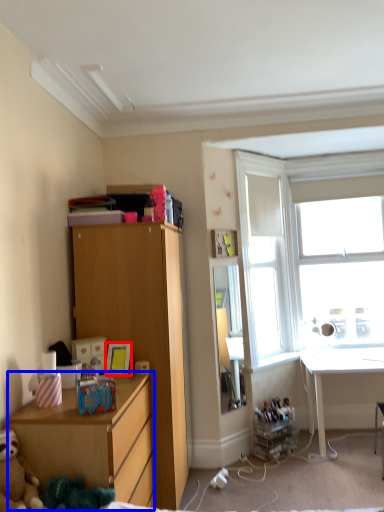
Question: Which point is further to the camera, picture frame (highlighted by a red box) or chest of drawers (highlighted by a blue box)?

Choices:
 (A) picture frame
 (B) chest of drawers

Answer: (A)